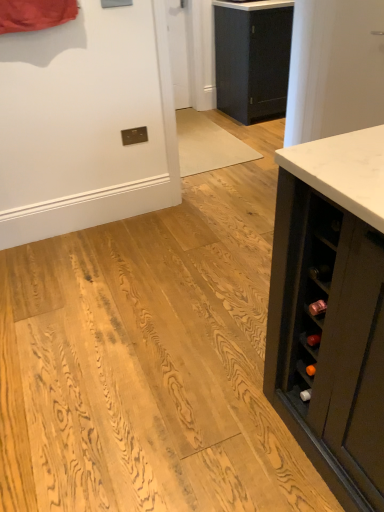
Describe the element at coordinates (254, 4) in the screenshot. This screenshot has width=384, height=512. I see `white marble countertop at upper center` at that location.

Find the location of a particular element. The image size is (384, 512). white marble countertop at upper center is located at coordinates (254, 4).

Measure the distance between white marble countertop at upper center and camera.

The depth of white marble countertop at upper center is 3.18 meters.

The width and height of the screenshot is (384, 512). What do you see at coordinates (252, 60) in the screenshot? I see `matte black cabinet at center` at bounding box center [252, 60].

Where is `matte black cabinet at center`? The image size is (384, 512). matte black cabinet at center is located at coordinates (252, 60).

Measure the distance between matte black cabinet at center and camera.

The distance of matte black cabinet at center from camera is 10.54 feet.

Measure the distance between point (250, 39) and camera.

Point (250, 39) and camera are 3.38 meters apart from each other.

Locate an element on the screen. Image resolution: width=384 pixels, height=512 pixels. white marble countertop at upper center is located at coordinates 254,4.

Is matte black cabinet at center at the left side of white marble countertop at upper center?

In fact, matte black cabinet at center is to the right of white marble countertop at upper center.

Consider the image. Is the depth of matte black cabinet at center less than that of white marble countertop at upper center?

No, it is not.

Does point (273, 41) come in front of point (279, 4)?

No.

From the image's perspective, which one is positioned higher, matte black cabinet at center or white marble countertop at upper center?

white marble countertop at upper center, from the image's perspective.

From a real-world perspective, which object stands above the other?

In real-world perspective, white marble countertop at upper center is above.

In terms of width, does matte black cabinet at center look wider or thinner when compared to white marble countertop at upper center?

matte black cabinet at center is thinner than white marble countertop at upper center.

Which of these two, matte black cabinet at center or white marble countertop at upper center, stands taller?

With more height is matte black cabinet at center.

Which of these two, matte black cabinet at center or white marble countertop at upper center, is bigger?

Answer: Bigger between the two is matte black cabinet at center.

Is white marble countertop at upper center a part of matte black cabinet at center?

No, white marble countertop at upper center is not inside matte black cabinet at center.

Are matte black cabinet at center and white marble countertop at upper center far apart?

No, there isn't a large distance between matte black cabinet at center and white marble countertop at upper center.

Could you tell me if matte black cabinet at center is facing white marble countertop at upper center?

No, matte black cabinet at center is not facing towards white marble countertop at upper center.

The height and width of the screenshot is (512, 384). What are the coordinates of `counter top above the matte black cabinet at center (from a real-world perspective)` in the screenshot? It's located at (254, 4).

Consider the image. Is white marble countertop at upper center at the right side of matte black cabinet at center?

Incorrect, white marble countertop at upper center is not on the right side of matte black cabinet at center.

Is white marble countertop at upper center closer to the viewer compared to matte black cabinet at center?

That is True.

Is point (262, 3) closer or farther from the camera than point (279, 34)?

Point (262, 3) is positioned closer to the camera compared to point (279, 34).

From the image's perspective, is white marble countertop at upper center beneath matte black cabinet at center?

No, from the image's perspective, white marble countertop at upper center is not below matte black cabinet at center.

From a real-world perspective, is white marble countertop at upper center under matte black cabinet at center?

Incorrect, from a real-world perspective, white marble countertop at upper center is higher than matte black cabinet at center.

Between white marble countertop at upper center and matte black cabinet at center, which one has larger width?

white marble countertop at upper center.

Can you confirm if white marble countertop at upper center is shorter than matte black cabinet at center?

Indeed, white marble countertop at upper center has a lesser height compared to matte black cabinet at center.

Based on the photo, does white marble countertop at upper center have a smaller size compared to matte black cabinet at center?

Correct, white marble countertop at upper center occupies less space than matte black cabinet at center.

Do you think white marble countertop at upper center is within matte black cabinet at center, or outside of it?

The correct answer is: outside.

Are white marble countertop at upper center and matte black cabinet at center beside each other?

No, white marble countertop at upper center is not beside matte black cabinet at center.

Could you tell me if white marble countertop at upper center is facing matte black cabinet at center?

No, white marble countertop at upper center is not turned towards matte black cabinet at center.

How different are the orientations of white marble countertop at upper center and matte black cabinet at center in degrees?

They differ by 0.000366 degrees in their facing directions.

Measure the distance between white marble countertop at upper center and matte black cabinet at center.

The distance of white marble countertop at upper center from matte black cabinet at center is 14.57 inches.

Find the location of a particular element. The image size is (384, 512). cabinetry that appears below the white marble countertop at upper center (from a real-world perspective) is located at coordinates (252, 60).

Locate an element on the screen. Image resolution: width=384 pixels, height=512 pixels. counter top on the left of matte black cabinet at center is located at coordinates (254, 4).

This screenshot has width=384, height=512. I want to click on cabinetry below the white marble countertop at upper center (from a real-world perspective), so click(x=252, y=60).